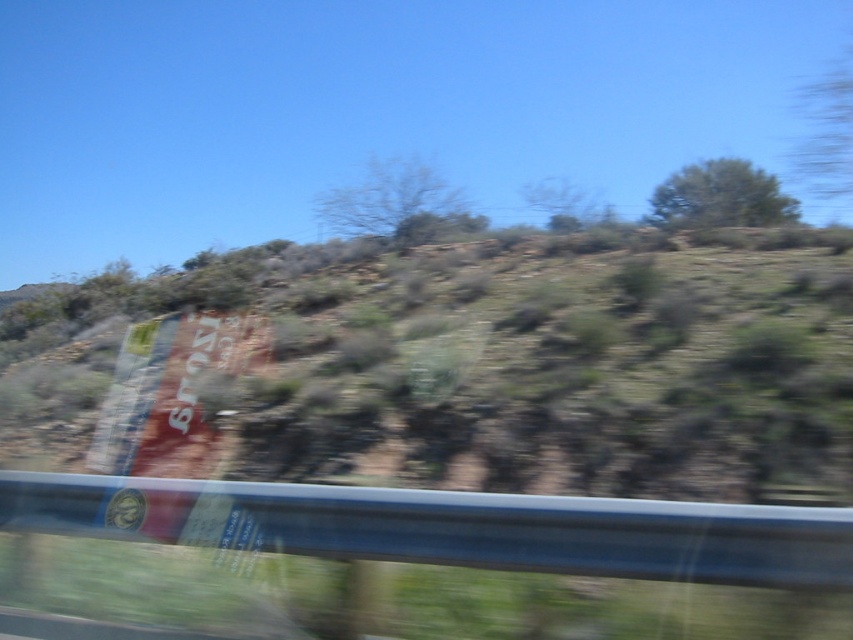
You are a passenger in a moving car. You notice the green shrubbery at center and the transparent glass car window at lower left. Which object appears bigger in the scene?

The green shrubbery at center appears bigger than the transparent glass car window at lower left because it has a larger size compared to the window.